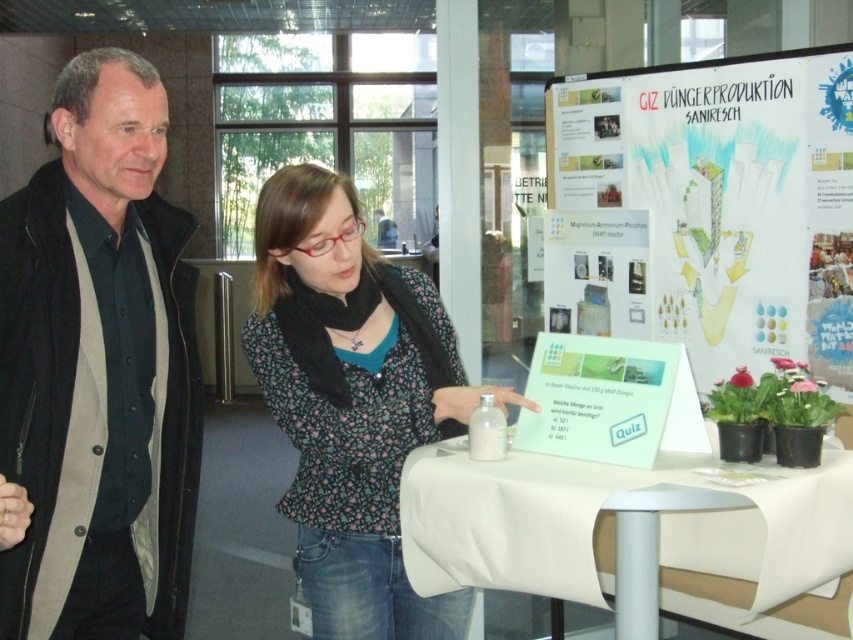
What object is located at the coordinates point (x=99, y=369)?

The point (x=99, y=369) corresponds to the black matte jacket at left.

You are organizing an event and need to place a 1.2 meter wide banner between the black matte jacket at left and the white fabric table at center. Can the space between them accommodate the banner?

The black matte jacket at left is narrower than the white fabric table at center, but the exact distance between them isn not specified. Without knowing the actual spacing, it is impossible to determine if the banner will fit.

You are an event planner trying to set up a photo backdrop for an upcoming event. You have a white paperboard at upper center and a floral fabric blouse at center. Which object should you choose if you need a wider surface to write event details on?

The white paperboard at upper center might be wider than the floral fabric blouse at center, so it would be the better choice for writing event details due to its potentially larger surface area.